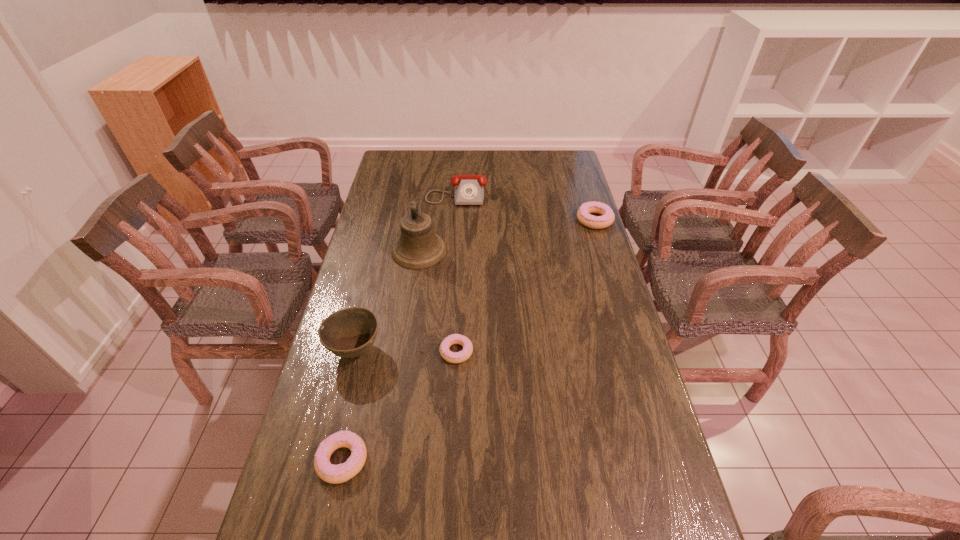
If equal spacing is desired by inserting an extra doughnut among them, please point out a free spot for this new doughnut. Please provide its 2D coordinates. Your answer should be formatted as a tuple, i.e. [(x, y)], where the tuple contains the x and y coordinates of a point satisfying the conditions above.

[(536, 276)]